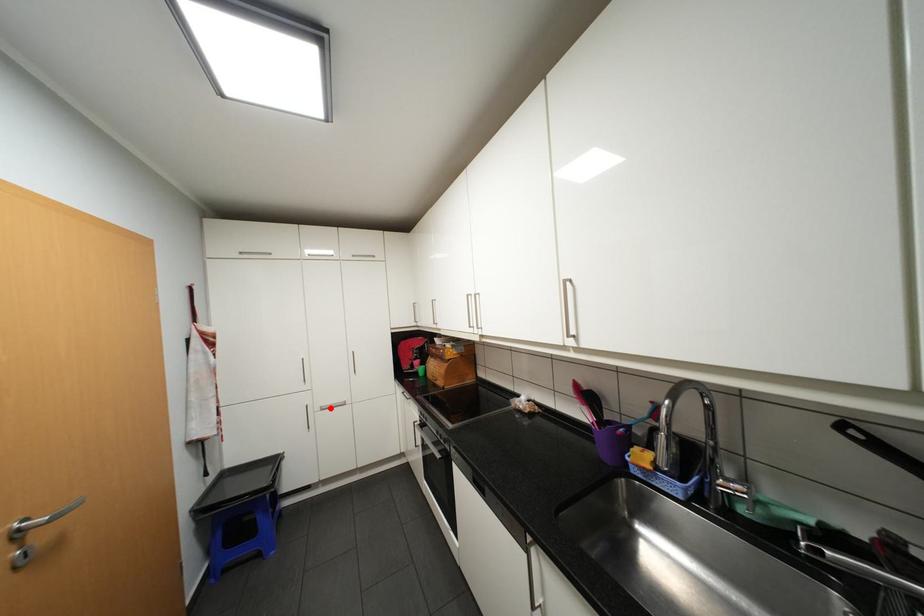
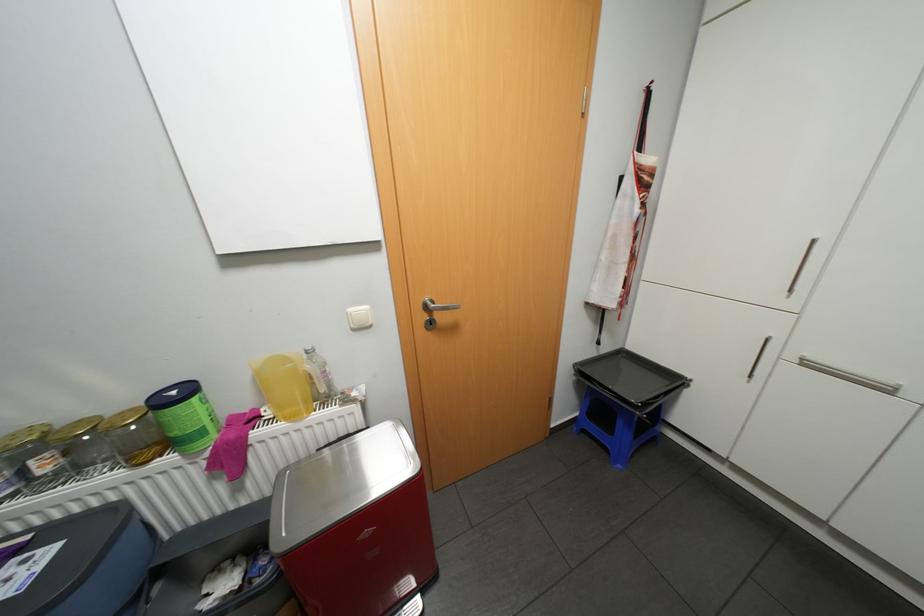
The point at the highlighted location is marked in the first image. Where is the corresponding point in the second image?

(813, 363)